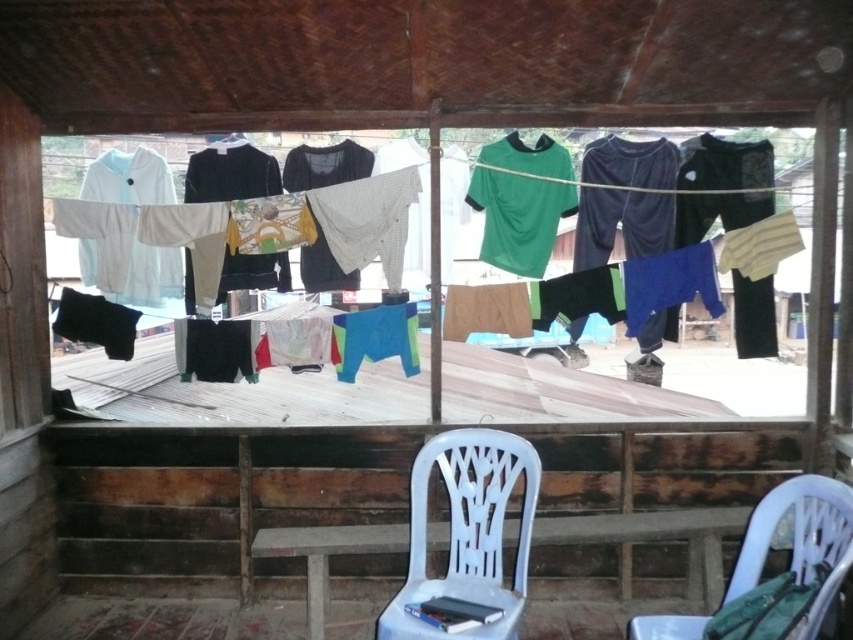
Does white fabric at center have a greater height compared to white plastic chair at lower right?

Correct, white fabric at center is much taller as white plastic chair at lower right.

Is point (701, 349) closer to camera compared to point (801, 577)?

No, (701, 349) is further to viewer.

Find the location of a particular element. The height and width of the screenshot is (640, 853). white fabric at center is located at coordinates (776, 308).

Is white fabric at center wider than white plastic chair at lower center?

Indeed, white fabric at center has a greater width compared to white plastic chair at lower center.

Can you confirm if white fabric at center is thinner than white plastic chair at lower center?

No, white fabric at center is not thinner than white plastic chair at lower center.

Between point (497, 272) and point (442, 458), which one is positioned in front?

Point (442, 458) is more forward.

Identify the location of white fabric at center. (776, 308).

Who is taller, white plastic chair at lower center or white plastic chair at lower right?

white plastic chair at lower center is taller.

From the picture: Who is more distant from viewer, (514, 470) or (648, 620)?

The point (514, 470) is more distant.

The width and height of the screenshot is (853, 640). Identify the location of white plastic chair at lower center. (467, 532).